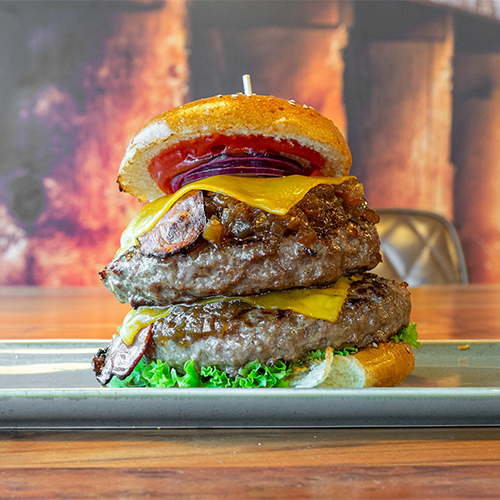
The image size is (500, 500). What are the coordinates of `wall` in the screenshot? It's located at (411, 108), (112, 61), (320, 62), (469, 135).